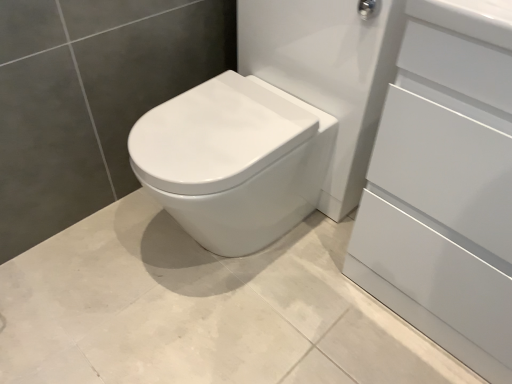
What do you see at coordinates (445, 185) in the screenshot? The height and width of the screenshot is (384, 512). I see `white glossy cabinet at right` at bounding box center [445, 185].

Find the location of `white glossy cabinet at right`. white glossy cabinet at right is located at coordinates (445, 185).

Locate an element on the screen. The image size is (512, 384). white glossy cabinet at right is located at coordinates coord(445,185).